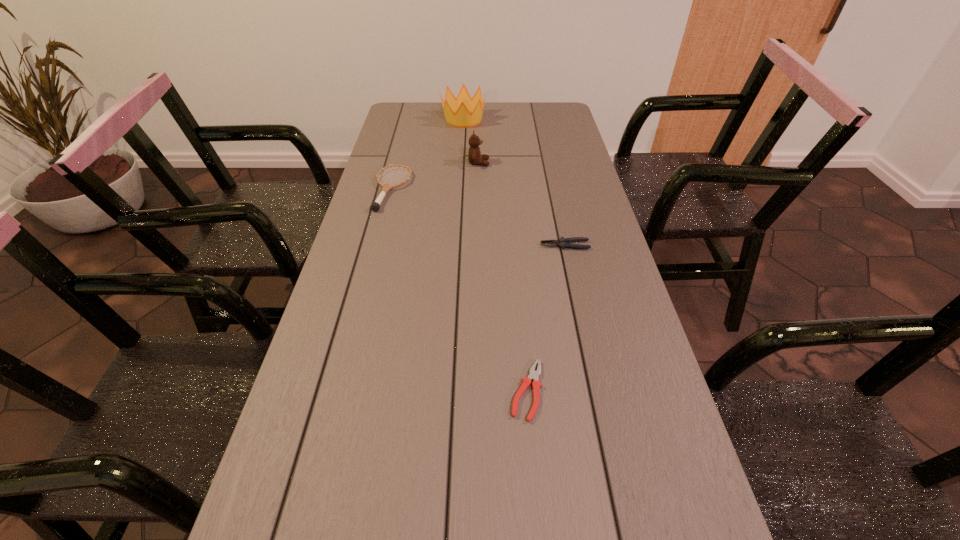
Locate which object ranks fourth in proximity to the fourth object from left to right. Please provide its 2D coordinates. Your answer should be formatted as a tuple, i.e. [(x, y)], where the tuple contains the x and y coordinates of a point satisfying the conditions above.

[(457, 111)]

At what (x,y) coordinates should I click in order to perform the action: click on free spot that satisfies the following two spatial constraints: 1. at the face of the teddy bear; 2. on the left side of the shorter pliers. Please return your answer as a coordinate pair (x, y). This screenshot has width=960, height=540. Looking at the image, I should click on point(478,390).